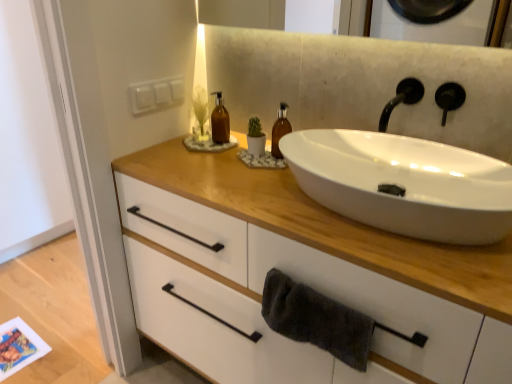
You are a GUI agent. You are given a task and a screenshot of the screen. Output one action in this format:
    pyautogui.click(x=<x>, y=<y>)
    Task: Click on the free space in front of translucent amber bottle at center, which is the second bottle in left-to-right order
    The image size is (512, 384).
    Given the screenshot: What is the action you would take?
    pyautogui.click(x=263, y=181)